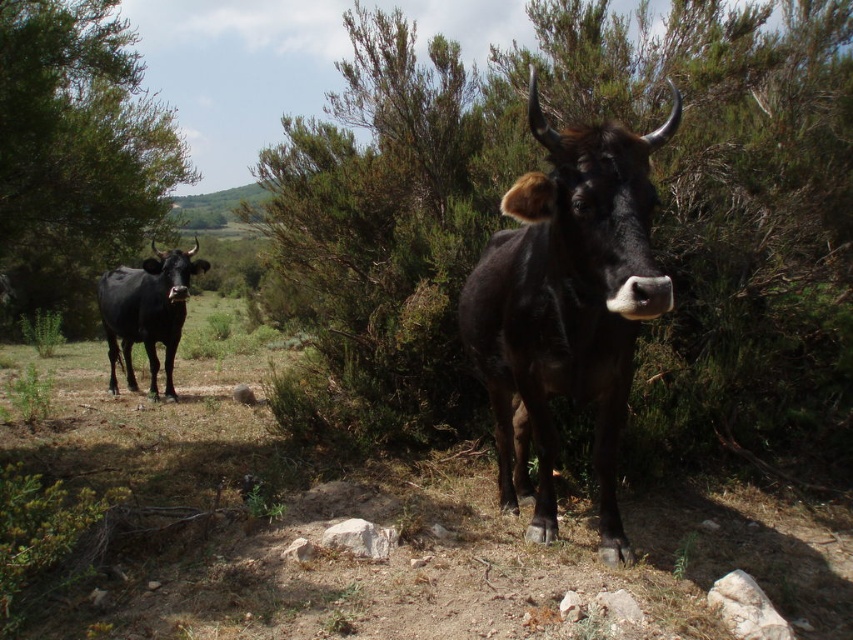
You are a farmer checking the vegetation in your field. You have a rope that is 3 meters long. You want to tie a fence between the green leafy bush at center and the green leafy tree at left. Can the rope reach between them?

The green leafy bush at center is narrower than the green leafy tree at left, but the distance between them isn

You are a farmer standing near the two cows in the rural scene. You want to walk from the cow facing the camera to the cow facing left. Which object, the green leafy bush at center or the green leafy tree at left, will you pass first?

The green leafy bush at center is closer to you than the green leafy tree at left, so you will pass the green leafy bush at center first.